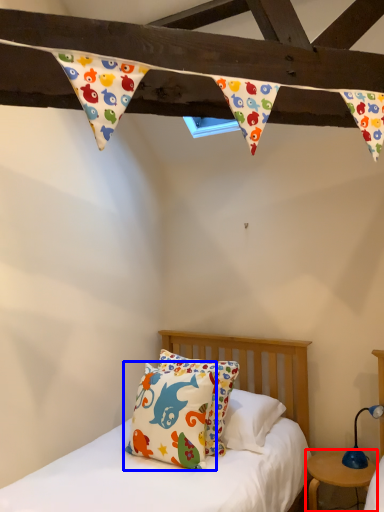
Question: Which object is further to the camera taking this photo, nightstand (highlighted by a red box) or pillow (highlighted by a blue box)?

Choices:
 (A) nightstand
 (B) pillow

Answer: (A)